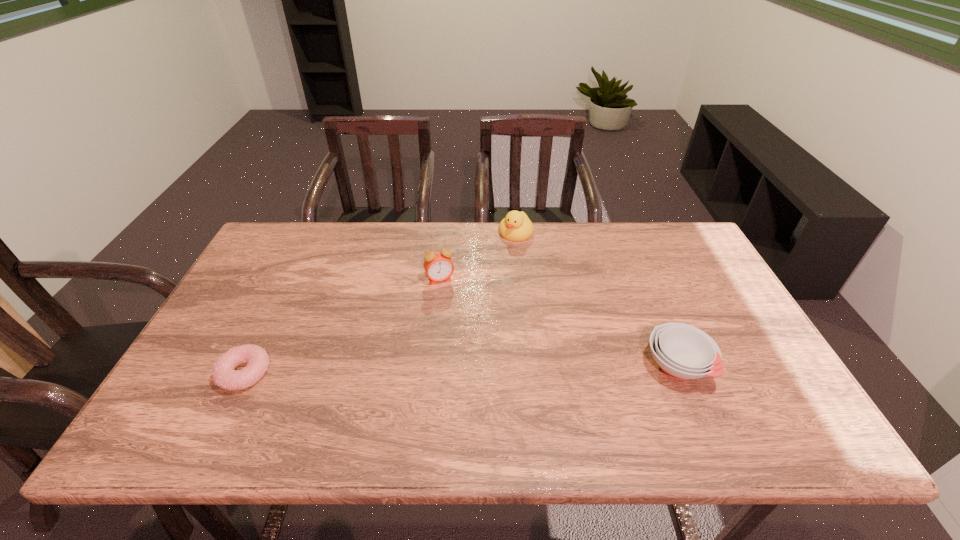
At what (x,y) coordinates should I click in order to perform the action: click on free point located 0.140m on the face of the third nearest object. Please return your answer as a coordinate pair (x, y). The width and height of the screenshot is (960, 540). Looking at the image, I should click on click(x=458, y=319).

This screenshot has width=960, height=540. Find the location of `vacant area located on the face of the third nearest object`. vacant area located on the face of the third nearest object is located at coordinates (459, 322).

This screenshot has width=960, height=540. Identify the location of vacant space situated on the face of the third nearest object. (454, 309).

In order to click on free space located on the face of the second tallest object in this screenshot , I will do `click(489, 273)`.

You are a GUI agent. You are given a task and a screenshot of the screen. Output one action in this format:
    pyautogui.click(x=<x>, y=<y>)
    Task: Click on the free space located on the face of the second tallest object
    This screenshot has width=960, height=540.
    Given the screenshot: What is the action you would take?
    pyautogui.click(x=470, y=300)

Find the location of a particular element. The height and width of the screenshot is (540, 960). vacant space located on the face of the second tallest object is located at coordinates (488, 275).

The width and height of the screenshot is (960, 540). I want to click on object that is at the far edge, so click(x=516, y=226).

In order to click on doughnut at the near edge in this screenshot , I will do `click(224, 375)`.

This screenshot has height=540, width=960. In order to click on soup bowl located at the near edge in this screenshot , I will do `click(683, 352)`.

Where is `object located in the left edge section of the desktop`? The image size is (960, 540). object located in the left edge section of the desktop is located at coordinates (224, 375).